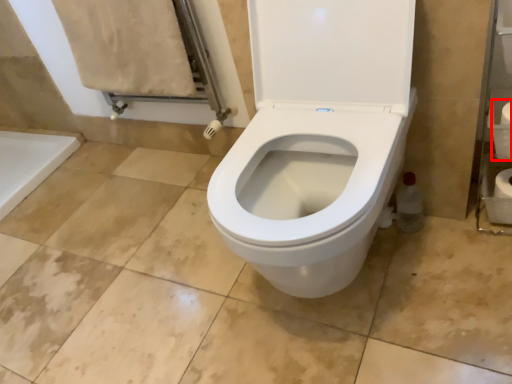
Question: Observing the image, what is the correct spatial positioning of toilet paper (annotated by the red box) in reference to toilet paper?

Choices:
 (A) left
 (B) right

Answer: (A)